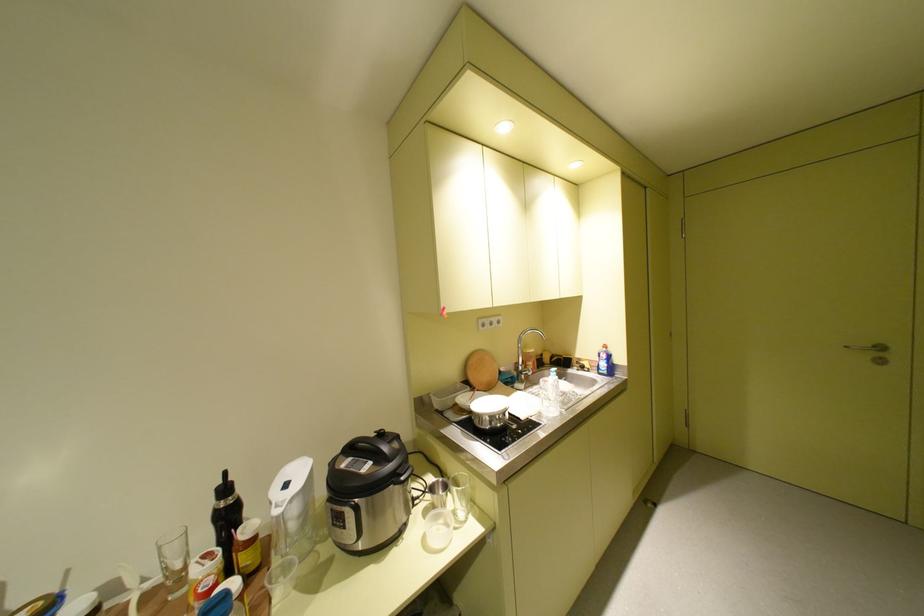
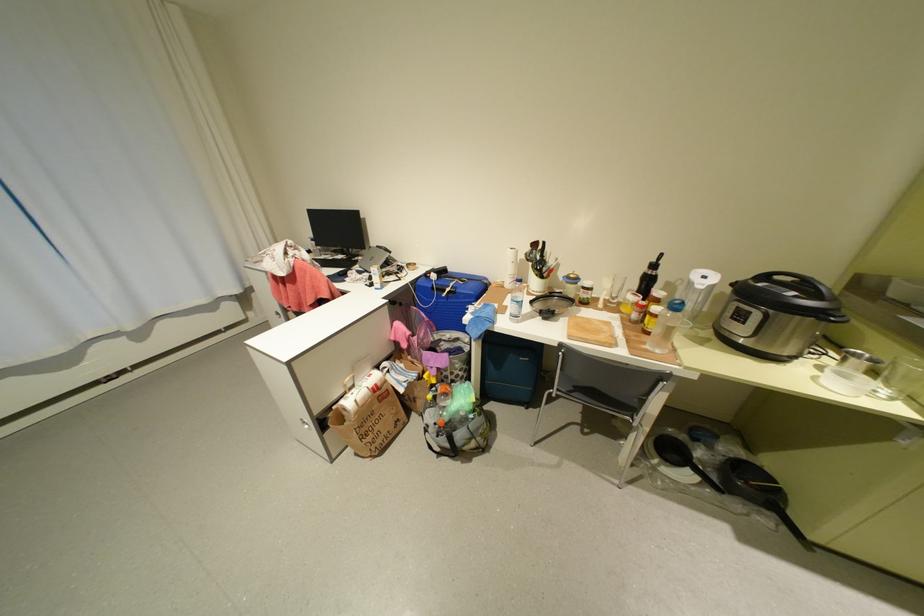
Find the pixel in the second image that matches the point at 228,545 in the first image.

(649, 294)